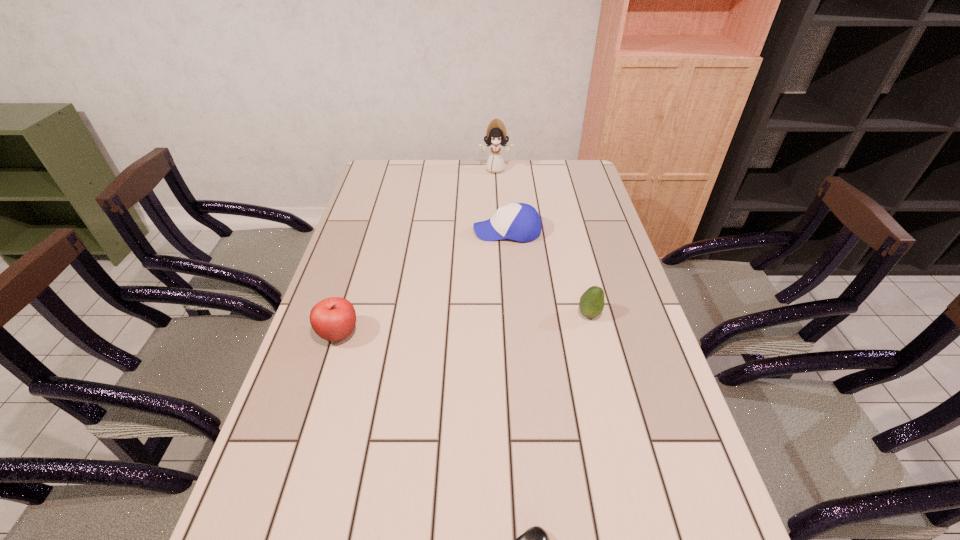
The width and height of the screenshot is (960, 540). In order to click on the tallest object in this screenshot , I will do `click(496, 136)`.

Locate an element on the screen. The width and height of the screenshot is (960, 540). doll is located at coordinates (496, 136).

Identify the location of apple. (333, 319).

You are a GUI agent. You are given a task and a screenshot of the screen. Output one action in this format:
    pyautogui.click(x=<x>, y=<y>)
    Task: Click on the avocado
    The image size is (960, 540).
    Given the screenshot: What is the action you would take?
    pyautogui.click(x=592, y=301)

This screenshot has height=540, width=960. In order to click on baseball cap in this screenshot , I will do `click(521, 222)`.

You are a GUI agent. You are given a task and a screenshot of the screen. Output one action in this format:
    pyautogui.click(x=<x>, y=<y>)
    Task: Click on the free space located 0.200m at the front face of the tallest object
    The width and height of the screenshot is (960, 540).
    Given the screenshot: What is the action you would take?
    pyautogui.click(x=497, y=202)

At what (x,y) coordinates should I click in order to perform the action: click on free space located 0.300m on the right of the leftmost object. Please return your answer as a coordinate pair (x, y). Looking at the image, I should click on (477, 334).

This screenshot has width=960, height=540. In order to click on vacant space located 0.330m on the back of the rightmost object in this screenshot , I will do `click(569, 234)`.

Locate an element on the screen. The width and height of the screenshot is (960, 540). vacant region located 0.260m on the front-facing side of the fourth nearest object is located at coordinates (395, 231).

The width and height of the screenshot is (960, 540). I want to click on vacant space situated 0.240m on the front-facing side of the fourth nearest object, so click(x=401, y=231).